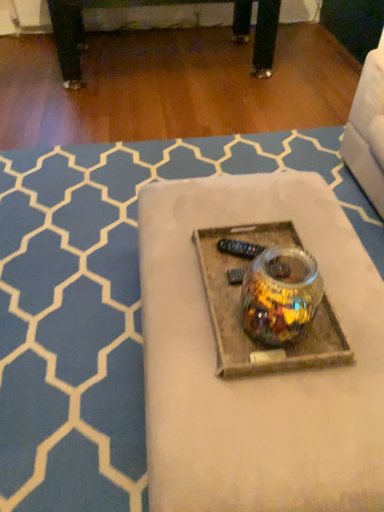
Locate an element on the screen. This screenshot has height=512, width=384. free space behind translucent glass jar at center is located at coordinates (180, 101).